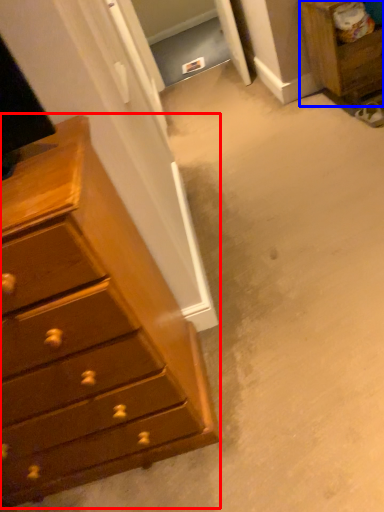
Question: Among these objects, which one is farthest to the camera, chest of drawers (highlighted by a red box) or nightstand (highlighted by a blue box)?

Choices:
 (A) chest of drawers
 (B) nightstand

Answer: (B)